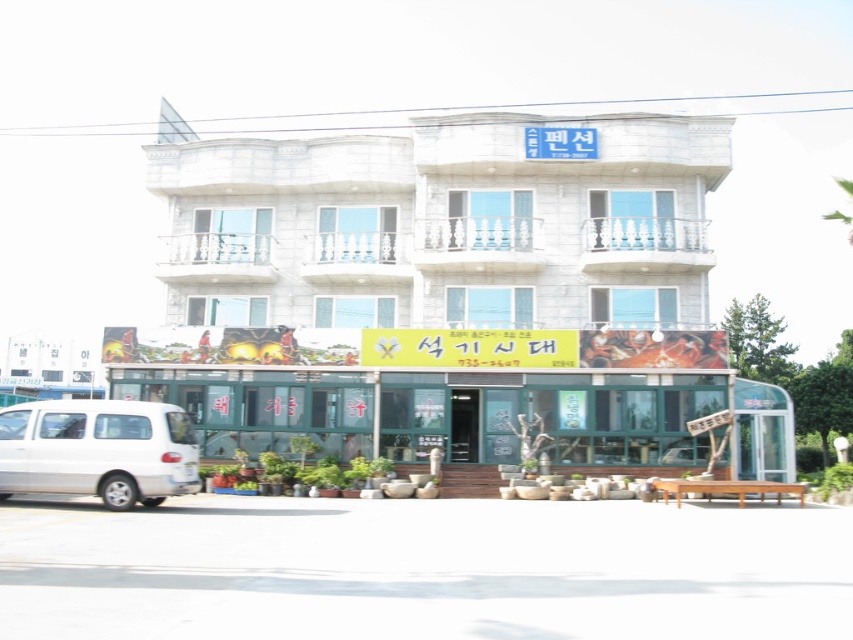
Question: Can you confirm if white stone building at center is smaller than white matte van at lower left?

Choices:
 (A) yes
 (B) no

Answer: (B)

Question: Which point is farther from the camera taking this photo?

Choices:
 (A) coord(125,412)
 (B) coord(560,230)

Answer: (B)

Question: Observing the image, what is the correct spatial positioning of white stone building at center in reference to white matte van at lower left?

Choices:
 (A) left
 (B) right

Answer: (B)

Question: Which of the following is the farthest from the observer?

Choices:
 (A) tap(119, 419)
 (B) tap(328, 388)

Answer: (B)

Question: Can you confirm if white stone building at center is bigger than white matte van at lower left?

Choices:
 (A) yes
 (B) no

Answer: (A)